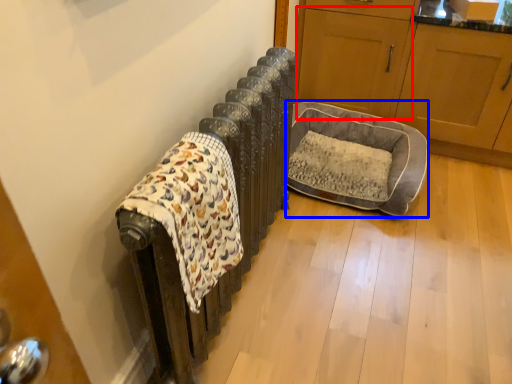
Question: Which object appears closest to the camera in this image, screen door (highlighted by a red box) or dog bed (highlighted by a blue box)?

Choices:
 (A) screen door
 (B) dog bed

Answer: (B)